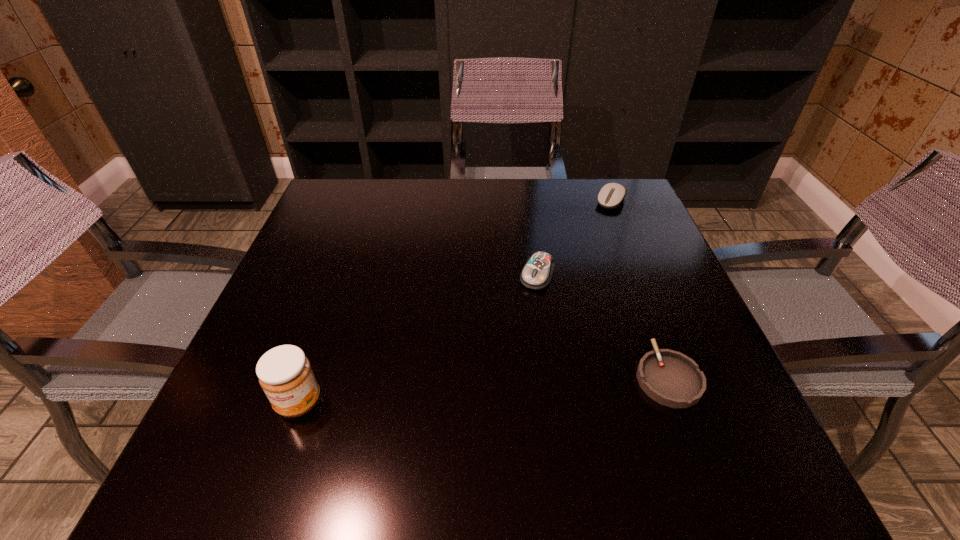
You are a GUI agent. You are given a task and a screenshot of the screen. Output one action in this format:
    pyautogui.click(x=<x>, y=<y>)
    Task: Click on the object that is at the near left corner
    
    Given the screenshot: What is the action you would take?
    pyautogui.click(x=284, y=372)

Locate an element on the screen. object present at the far right corner is located at coordinates (611, 195).

The height and width of the screenshot is (540, 960). I want to click on object located at the near right corner, so click(672, 379).

Find the location of a particular element. This screenshot has width=960, height=540. free region at the far edge of the desktop is located at coordinates (470, 213).

The height and width of the screenshot is (540, 960). In order to click on free spot at the near edge of the desktop in this screenshot , I will do `click(531, 414)`.

Image resolution: width=960 pixels, height=540 pixels. I want to click on free space at the right edge of the desktop, so click(x=638, y=357).

This screenshot has height=540, width=960. I want to click on vacant space at the far left corner, so click(344, 209).

In the image, there is a desktop. Where is `vacant space at the near left corner`? The width and height of the screenshot is (960, 540). vacant space at the near left corner is located at coordinates (250, 391).

Where is `free space at the far right corner of the desktop`? free space at the far right corner of the desktop is located at coordinates (623, 204).

Where is `blank region between the left computer mouse and the farthest object`? This screenshot has height=540, width=960. blank region between the left computer mouse and the farthest object is located at coordinates (574, 238).